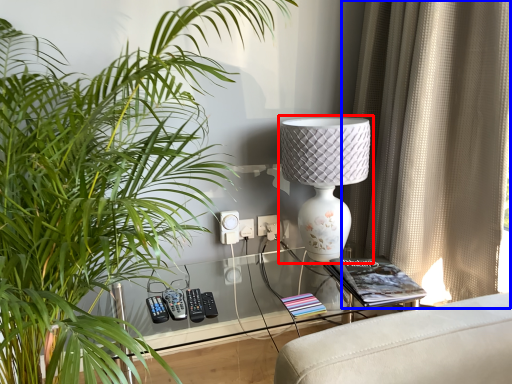
Question: Which point is further to the camera, lamp (highlighted by a red box) or curtain (highlighted by a blue box)?

Choices:
 (A) lamp
 (B) curtain

Answer: (A)